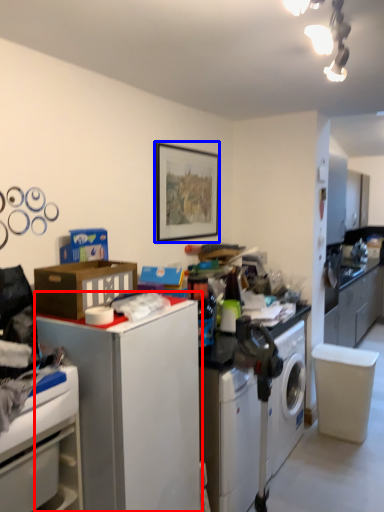
Question: Which object is further to the camera taking this photo, file cabinet (highlighted by a red box) or picture frame (highlighted by a blue box)?

Choices:
 (A) file cabinet
 (B) picture frame

Answer: (B)